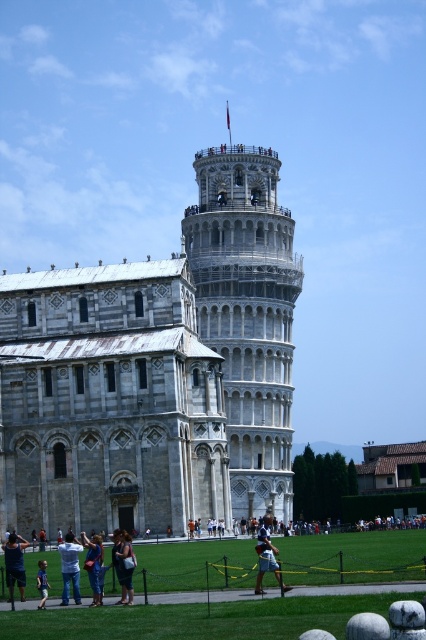
You are a tour guide explaining the scene to visitors. You mention both the light blue denim jeans at lower center and the light blue jeans at lower left. Which pair of jeans has a narrower width?

The light blue denim jeans at lower center has a narrower width compared to the light blue jeans at lower left.

Consider the image. You are a tourist visiting the Leaning Tower of Pisa and notice two pairs of jeans in the foreground. According to the scene, which pair of jeans is closer to you, the light blue denim jeans at lower center or the blue denim jeans at lower left?

The light blue denim jeans at lower center is positioned under the blue denim jeans at lower left, meaning the blue denim jeans at lower left is closer to you.

You are a tourist visiting the Leaning Tower of Pisa and notice two items in the foreground. You see the dark brown leather jacket at lower center and the blue denim jeans at lower left. Which item is positioned higher relative to the other?

The dark brown leather jacket at lower center is above the blue denim jeans at lower left, so it is positioned higher.